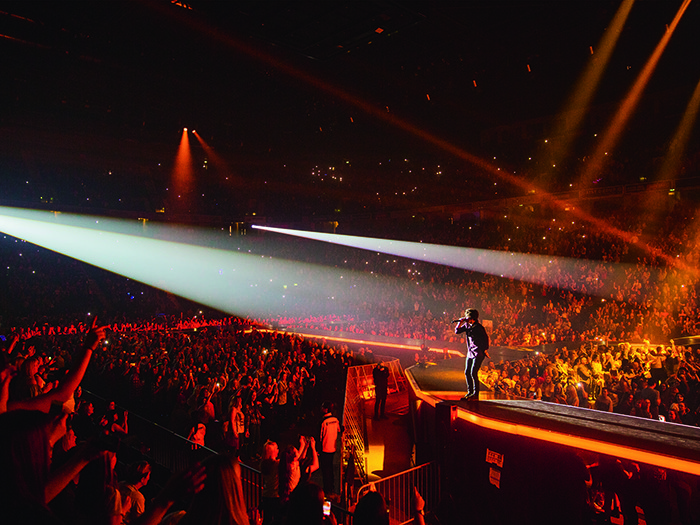
Image resolution: width=700 pixels, height=525 pixels. In order to click on stage in this screenshot , I will do `click(640, 454)`, `click(593, 434)`, `click(530, 413)`, `click(490, 408)`.